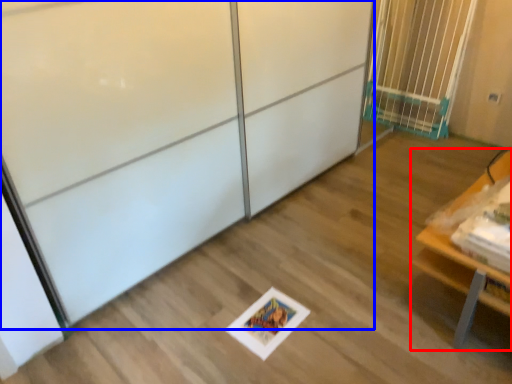
Question: Among these objects, which one is nearest to the camera, furniture (highlighted by a red box) or screen door (highlighted by a blue box)?

Choices:
 (A) furniture
 (B) screen door

Answer: (B)